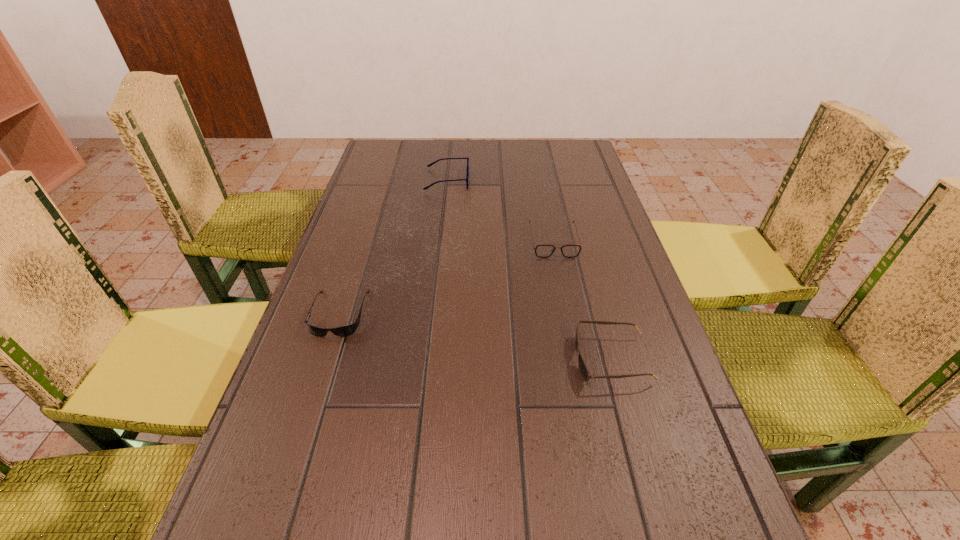
Where is `free space at the far edge`? This screenshot has width=960, height=540. free space at the far edge is located at coordinates click(x=441, y=166).

At what (x,y) coordinates should I click in order to perform the action: click on free space at the left edge of the desktop. Please return your answer as a coordinate pair (x, y). This screenshot has width=960, height=540. Looking at the image, I should click on (278, 455).

Identify the location of vacant space at the right edge. (579, 265).

Where is `vacant point at the far left corner`? Image resolution: width=960 pixels, height=540 pixels. vacant point at the far left corner is located at coordinates (419, 142).

Where is `unoccupied area between the third object from right to left and the leftmost sunglasses`? Image resolution: width=960 pixels, height=540 pixels. unoccupied area between the third object from right to left and the leftmost sunglasses is located at coordinates (394, 247).

The height and width of the screenshot is (540, 960). What are the coordinates of `blank region between the spectacles and the leftmost sunglasses` in the screenshot? It's located at (394, 247).

Locate which object is the third closest to the farthest sunglasses. Please provide its 2D coordinates. Your answer should be formatted as a tuple, i.e. [(x, y)], where the tuple contains the x and y coordinates of a point satisfying the conditions above.

[(350, 329)]

Select which object appears as the third closest to the third object from right to left. Please provide its 2D coordinates. Your answer should be formatted as a tuple, i.e. [(x, y)], where the tuple contains the x and y coordinates of a point satisfying the conditions above.

[(584, 371)]

Image resolution: width=960 pixels, height=540 pixels. What are the coordinates of `sunglasses identified as the third closest to the farthest object` in the screenshot? It's located at (584, 371).

Identify which sunglasses is the nearest to the farthest sunglasses. Please provide its 2D coordinates. Your answer should be formatted as a tuple, i.e. [(x, y)], where the tuple contains the x and y coordinates of a point satisfying the conditions above.

[(584, 371)]